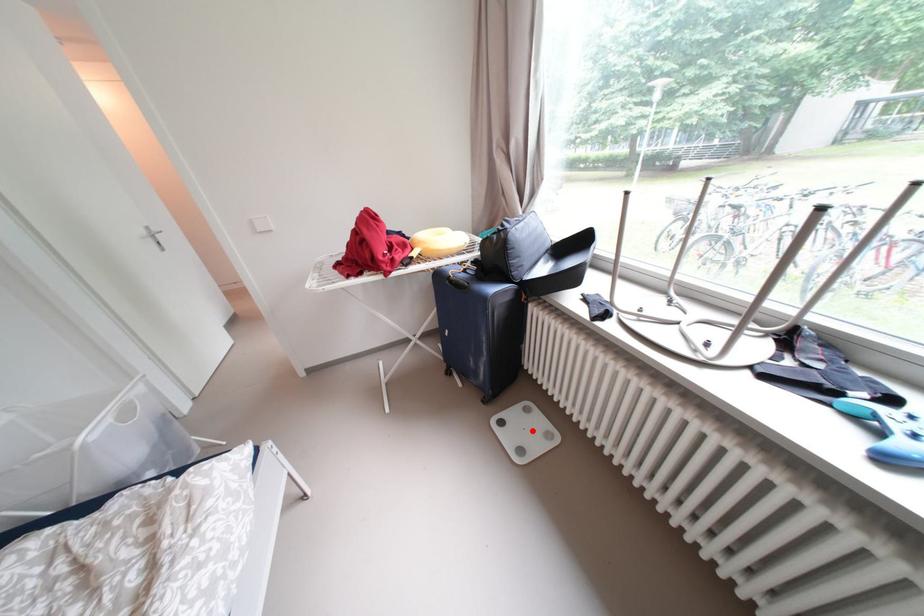
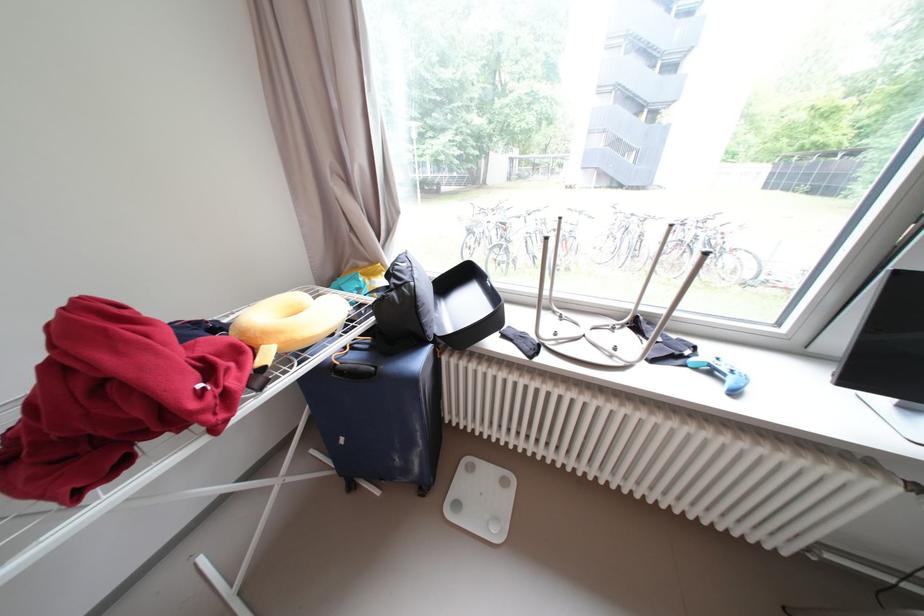
In the second image, find the point that corresponds to the highlighted location in the first image.

(490, 495)